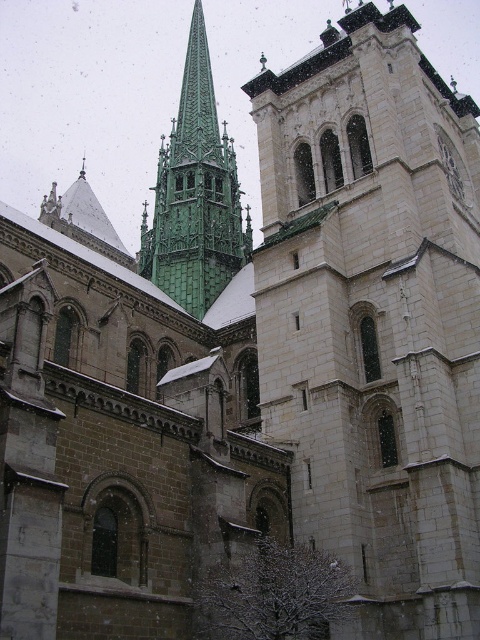
Question: Which point is farther to the camera?

Choices:
 (A) green stone spire at upper left
 (B) white stone tower at center

Answer: (A)

Question: Is white stone tower at center bigger than green stone spire at upper left?

Choices:
 (A) yes
 (B) no

Answer: (B)

Question: Is white stone tower at center above green stone spire at upper left?

Choices:
 (A) yes
 (B) no

Answer: (B)

Question: Is white stone tower at center wider than green stone spire at upper left?

Choices:
 (A) yes
 (B) no

Answer: (A)

Question: Which of the following is the closest to the observer?

Choices:
 (A) (295, 342)
 (B) (215, 282)

Answer: (A)